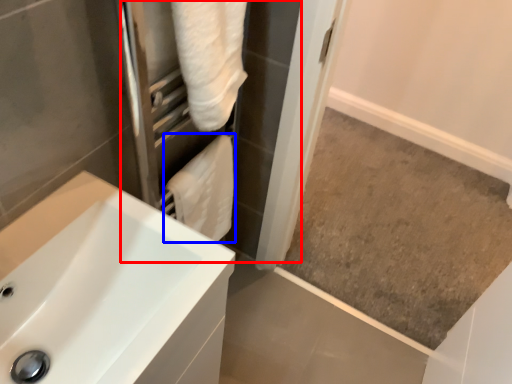
Question: Among these objects, which one is farthest to the camera, screen door (highlighted by a red box) or bath towel (highlighted by a blue box)?

Choices:
 (A) screen door
 (B) bath towel

Answer: (B)